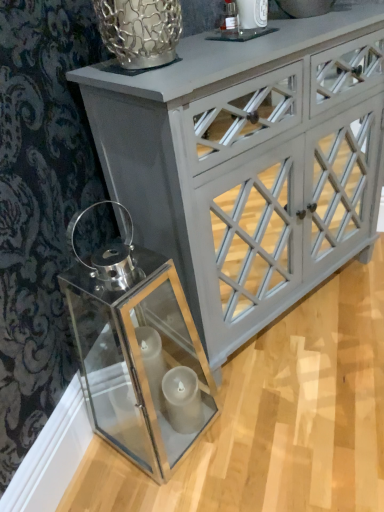
The height and width of the screenshot is (512, 384). What are the coordinates of `clear glass lantern at lower left` in the screenshot? It's located at (137, 358).

Describe the element at coordinates (137, 358) in the screenshot. I see `clear glass lantern at lower left` at that location.

In order to face clear glass lantern at lower left, should I rotate leftwards or rightwards?

Rotate left and turn 8.424 degrees.

What do you see at coordinates (250, 163) in the screenshot? I see `white painted wood cabinet at upper center` at bounding box center [250, 163].

I want to click on white painted wood cabinet at upper center, so click(x=250, y=163).

In order to face white painted wood cabinet at upper center, should I rotate leftwards or rightwards?

You should look right and rotate roughly 11.691 degrees.

Identify the location of clear glass lantern at lower left. (137, 358).

Is clear glass lantern at lower left to the left of white painted wood cabinet at upper center from the viewer's perspective?

Correct, you'll find clear glass lantern at lower left to the left of white painted wood cabinet at upper center.

Is the depth of clear glass lantern at lower left less than that of white painted wood cabinet at upper center?

Yes, the depth of clear glass lantern at lower left is less than that of white painted wood cabinet at upper center.

Between point (106, 380) and point (346, 84), which one is positioned behind?

Point (106, 380)

From the image's perspective, would you say clear glass lantern at lower left is positioned over white painted wood cabinet at upper center?

No, from the image's perspective, clear glass lantern at lower left is not above white painted wood cabinet at upper center.

Consider the image. From a real-world perspective, which object stands above the other?

In real-world perspective, white painted wood cabinet at upper center is above.

Considering the sizes of objects clear glass lantern at lower left and white painted wood cabinet at upper center in the image provided, who is wider, clear glass lantern at lower left or white painted wood cabinet at upper center?

Wider between the two is white painted wood cabinet at upper center.

Which of these two, clear glass lantern at lower left or white painted wood cabinet at upper center, stands taller?

white painted wood cabinet at upper center is taller.

Looking at this image, can you confirm if clear glass lantern at lower left is bigger than white painted wood cabinet at upper center?

No, clear glass lantern at lower left is not bigger than white painted wood cabinet at upper center.

Is white painted wood cabinet at upper center a part of clear glass lantern at lower left?

That's incorrect, white painted wood cabinet at upper center is not inside clear glass lantern at lower left.

Is clear glass lantern at lower left far away from white painted wood cabinet at upper center?

That's not correct — clear glass lantern at lower left is a little close to white painted wood cabinet at upper center.

Is clear glass lantern at lower left oriented towards white painted wood cabinet at upper center?

No, clear glass lantern at lower left is not facing towards white painted wood cabinet at upper center.

How many degrees apart are the facing directions of clear glass lantern at lower left and white painted wood cabinet at upper center?

The facing directions of clear glass lantern at lower left and white painted wood cabinet at upper center are 33.8 degrees apart.

Locate an element on the screen. glass box on the left of white painted wood cabinet at upper center is located at coordinates (137, 358).

Between white painted wood cabinet at upper center and clear glass lantern at lower left, which one appears on the left side from the viewer's perspective?

clear glass lantern at lower left.

Is white painted wood cabinet at upper center in front of clear glass lantern at lower left?

No, it is behind clear glass lantern at lower left.

Which is nearer, (281, 58) or (90, 331)?

The point (281, 58) is closer to the camera.

From the image's perspective, between white painted wood cabinet at upper center and clear glass lantern at lower left, which one is located above?

white painted wood cabinet at upper center appears higher in the image.

From a real-world perspective, does white painted wood cabinet at upper center sit lower than clear glass lantern at lower left?

No, from a real-world perspective, white painted wood cabinet at upper center is not under clear glass lantern at lower left.

Which of these two, white painted wood cabinet at upper center or clear glass lantern at lower left, is thinner?

clear glass lantern at lower left.

Does white painted wood cabinet at upper center have a greater height compared to clear glass lantern at lower left?

Correct, white painted wood cabinet at upper center is much taller as clear glass lantern at lower left.

Can you confirm if white painted wood cabinet at upper center is bigger than clear glass lantern at lower left?

Indeed, white painted wood cabinet at upper center has a larger size compared to clear glass lantern at lower left.

Does white painted wood cabinet at upper center contain clear glass lantern at lower left?

Actually, clear glass lantern at lower left is outside white painted wood cabinet at upper center.

Is the surface of white painted wood cabinet at upper center in direct contact with clear glass lantern at lower left?

They are not placed beside each other.

Is white painted wood cabinet at upper center facing towards clear glass lantern at lower left?

No, white painted wood cabinet at upper center is not facing towards clear glass lantern at lower left.

How many degrees apart are the facing directions of white painted wood cabinet at upper center and clear glass lantern at lower left?

The angular difference between white painted wood cabinet at upper center and clear glass lantern at lower left is 33.8 degrees.

Could you measure the distance between white painted wood cabinet at upper center and clear glass lantern at lower left?

white painted wood cabinet at upper center and clear glass lantern at lower left are 12.53 inches apart from each other.

At what (x,y) coordinates should I click in order to perform the action: click on glass box below the white painted wood cabinet at upper center (from a real-world perspective). Please return your answer as a coordinate pair (x, y). Looking at the image, I should click on (137, 358).

Locate an element on the screen. The width and height of the screenshot is (384, 512). chest of drawers above the clear glass lantern at lower left (from the image's perspective) is located at coordinates (250, 163).

You are a GUI agent. You are given a task and a screenshot of the screen. Output one action in this format:
    pyautogui.click(x=<x>, y=<y>)
    Task: Click on the chest of drawers positioned vertically above the clear glass lantern at lower left (from a real-world perspective)
    Image resolution: width=384 pixels, height=512 pixels.
    Given the screenshot: What is the action you would take?
    pyautogui.click(x=250, y=163)